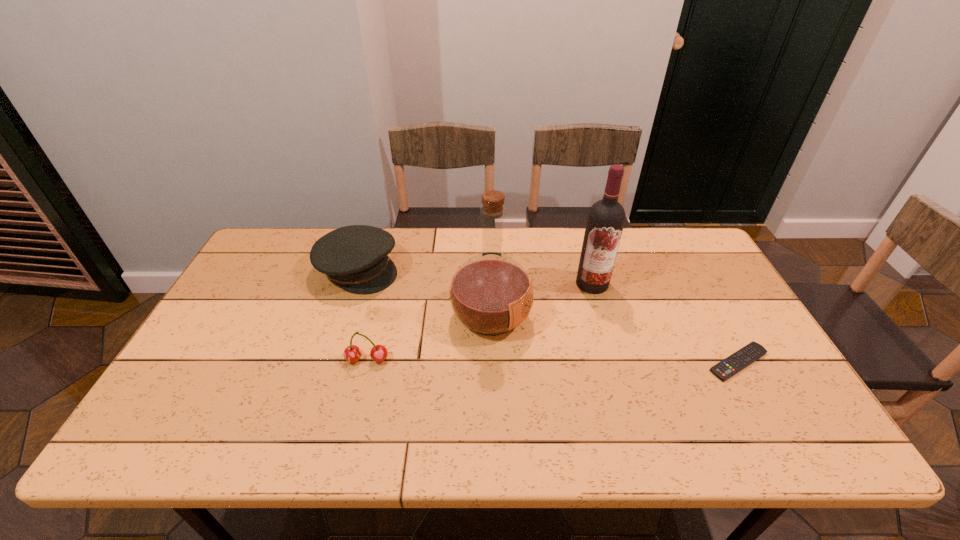
At what (x,y) coordinates should I click in order to perform the action: click on object at the near right corner. Please return your answer as a coordinate pair (x, y). The height and width of the screenshot is (540, 960). Looking at the image, I should click on (725, 369).

This screenshot has width=960, height=540. In the image, there is a desktop. Find the location of `vacant space at the far edge`. vacant space at the far edge is located at coordinates (440, 266).

The height and width of the screenshot is (540, 960). What are the coordinates of `vacant space at the near edge` in the screenshot? It's located at (408, 410).

This screenshot has width=960, height=540. Find the location of `vacant space at the left edge of the desktop`. vacant space at the left edge of the desktop is located at coordinates (205, 352).

Where is `free region at the right edge of the desktop`? This screenshot has height=540, width=960. free region at the right edge of the desktop is located at coordinates (718, 299).

The width and height of the screenshot is (960, 540). I want to click on vacant space at the far left corner of the desktop, so click(x=272, y=270).

Image resolution: width=960 pixels, height=540 pixels. I want to click on free region at the near left corner of the desktop, so click(x=210, y=411).

At what (x,y) coordinates should I click in order to perform the action: click on vacant space at the far right corner of the desktop. Please return your answer as a coordinate pair (x, y). Image resolution: width=960 pixels, height=540 pixels. Looking at the image, I should click on (x=650, y=227).

Where is `vacant area at the near right corner`? The height and width of the screenshot is (540, 960). vacant area at the near right corner is located at coordinates (780, 405).

You are a GUI agent. You are given a task and a screenshot of the screen. Output one action in this format:
    pyautogui.click(x=<x>, y=<y>)
    Task: Click on the vacant area that lies between the rightmost object and the cherry
    This screenshot has width=960, height=540.
    Given the screenshot: What is the action you would take?
    pyautogui.click(x=553, y=361)